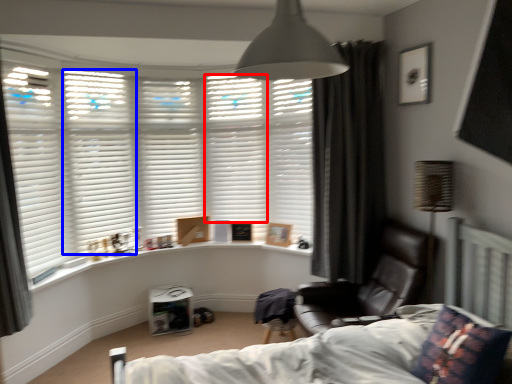
Question: Which object appears farthest to the camera in this image, shutter (highlighted by a red box) or shutter (highlighted by a blue box)?

Choices:
 (A) shutter
 (B) shutter

Answer: (A)